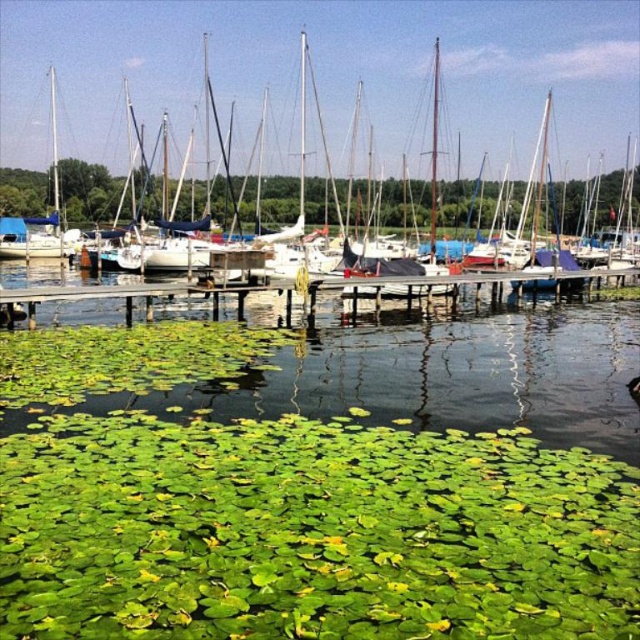
You are standing at the wooden pier and see a white matte sailboat at center. If you walk towards the point with coordinates (305, 148), will you end up on the sailboat?

Yes, because the point (305, 148) is on the white matte sailboat at center.

You are a photographer planning to capture the white matte sailboat at center and the wooden dock at center from a low angle. Which object will appear taller in your photo?

The white matte sailboat at center will appear taller in the photo because it has a greater height compared to the wooden dock at center.

You are a boat operator trying to navigate a new white matte sailboat at center into the marina. The wooden dock at center is already occupied by another vessel. Can you safely maneuver your boat alongside the dock without exceeding its width?

The white matte sailboat at center is wider than the wooden dock at center, so it cannot be safely maneuvered alongside the dock without exceeding its width.